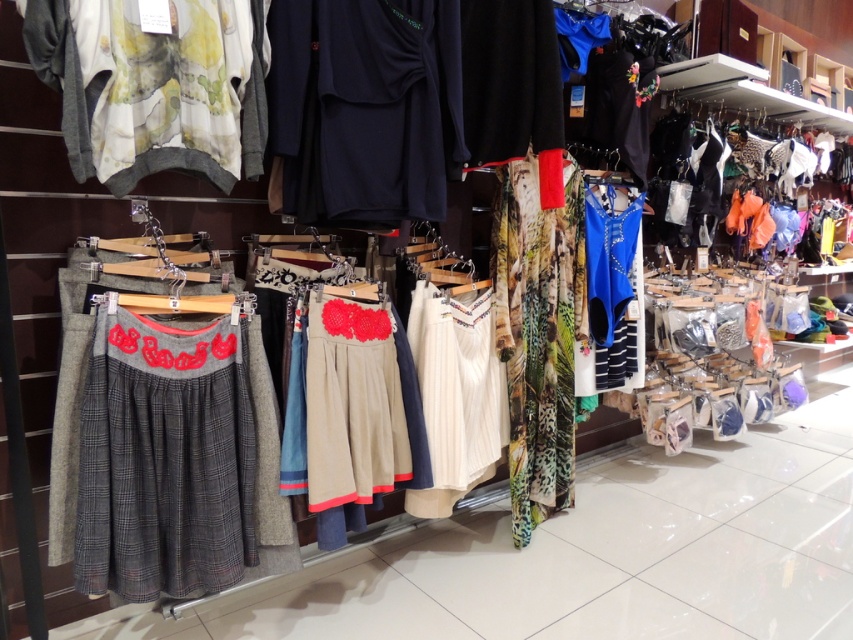
Is printed fabric dress at center below white textured dress at center?

No, printed fabric dress at center is not below white textured dress at center.

Does printed fabric dress at center come behind white textured dress at center?

Yes, it is.

Measure the distance between point (549, 280) and camera.

A distance of 2.43 meters exists between point (549, 280) and camera.

Locate an element on the screen. Image resolution: width=853 pixels, height=640 pixels. printed fabric dress at center is located at coordinates (537, 333).

In the scene shown: Is watercolor fabric blouse at upper left wider than printed fabric dress at center?

Yes.

Is watercolor fabric blouse at upper left thinner than printed fabric dress at center?

No.

Does point (136, 138) come closer to viewer compared to point (508, 189)?

Yes.

You are a GUI agent. You are given a task and a screenshot of the screen. Output one action in this format:
    pyautogui.click(x=<x>, y=<y>)
    Task: Click on the watercolor fabric blouse at upper left
    Image resolution: width=853 pixels, height=640 pixels.
    Given the screenshot: What is the action you would take?
    point(154,84)

Between navy blue fabric dress at center and printed fabric dress at center, which one is positioned higher?

navy blue fabric dress at center

You are a GUI agent. You are given a task and a screenshot of the screen. Output one action in this format:
    pyautogui.click(x=<x>, y=<y>)
    Task: Click on the navy blue fabric dress at center
    The image size is (853, 640).
    Given the screenshot: What is the action you would take?
    pyautogui.click(x=364, y=108)

Does point (286, 134) come closer to viewer compared to point (576, 285)?

That is True.

This screenshot has width=853, height=640. Find the location of `navy blue fabric dress at center`. navy blue fabric dress at center is located at coordinates (364, 108).